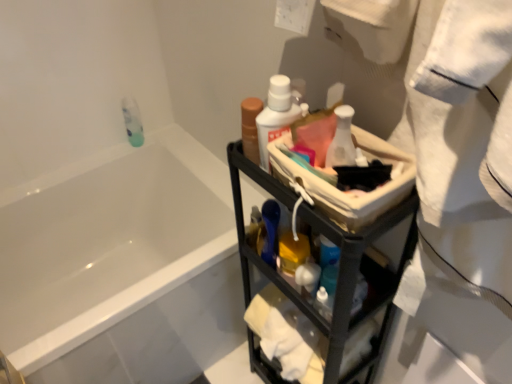
In order to click on free space to the right of translucent plastic mouthwash at upper left, positioned as the 1th mouthwash in left-to-right order in this screenshot , I will do `click(180, 149)`.